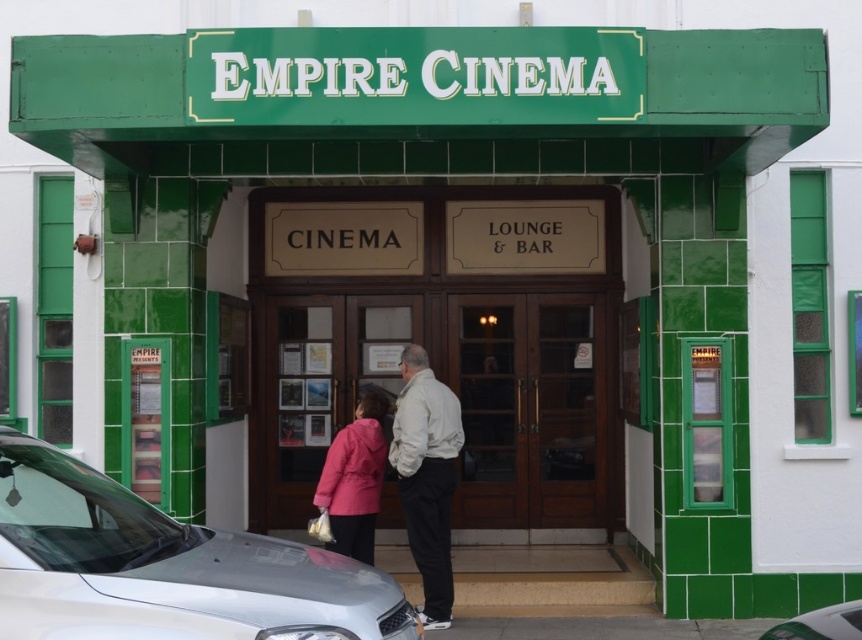
Who is more forward, (358, 212) or (538, 410)?

Point (358, 212) is more forward.

Measure the distance from wooden doors at center to brown wooden door at center.

9.91 inches

The width and height of the screenshot is (862, 640). I want to click on wooden doors at center, so click(x=442, y=344).

At what (x,y) coordinates should I click in order to perform the action: click on wooden doors at center. Please return your answer as a coordinate pair (x, y). Looking at the image, I should click on (442, 344).

Who is taller, white matte jacket at center or silver metallic car at lower right?

Standing taller between the two is white matte jacket at center.

Describe the element at coordinates (428, 476) in the screenshot. I see `white matte jacket at center` at that location.

Identify the location of white matte jacket at center. (428, 476).

Consider the image. Is wooden doors at center below silver metallic car at lower left?

No, wooden doors at center is not below silver metallic car at lower left.

What are the coordinates of `wooden doors at center` in the screenshot? It's located at [x=442, y=344].